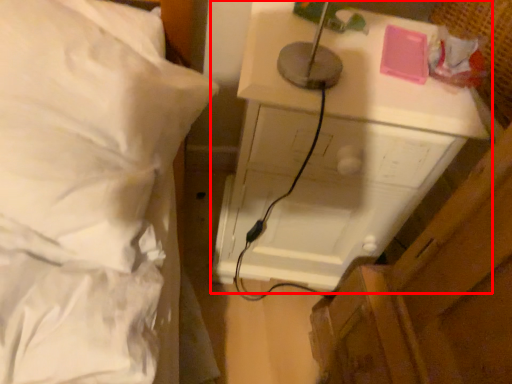
Question: Observing the image, what is the correct spatial positioning of furniture (annotated by the red box) in reference to bed?

Choices:
 (A) right
 (B) left

Answer: (A)